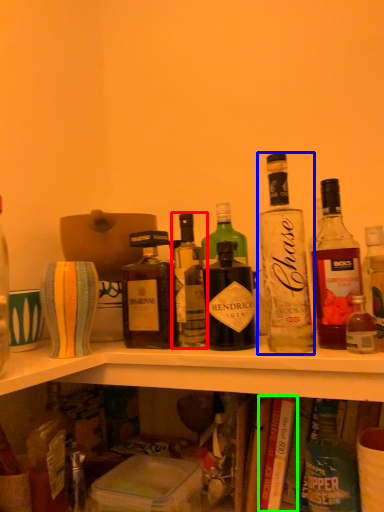
Question: Estimate the real-world distances between objects in this image. Which object is farther from bottle (highlighted by a red box), bottle (highlighted by a blue box) or book (highlighted by a green box)?

Choices:
 (A) bottle
 (B) book

Answer: (B)